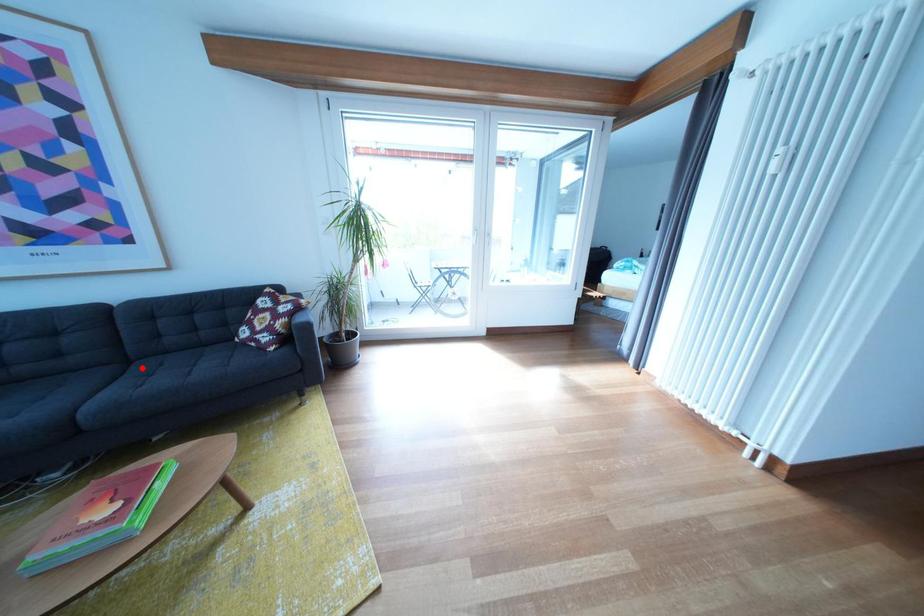
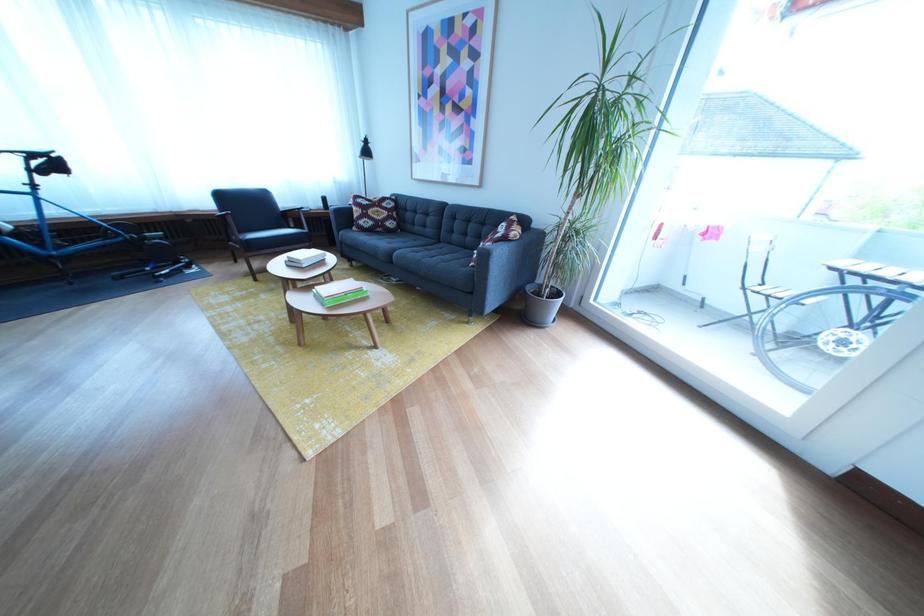
The point at the highlighted location is marked in the first image. Where is the corresponding point in the second image?

(453, 248)